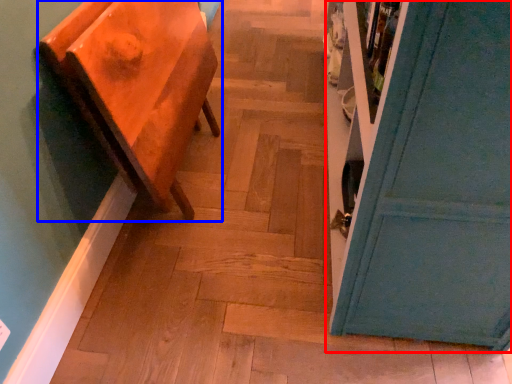
Question: Which object appears closest to the camera in this image, door (highlighted by a red box) or furniture (highlighted by a blue box)?

Choices:
 (A) door
 (B) furniture

Answer: (A)